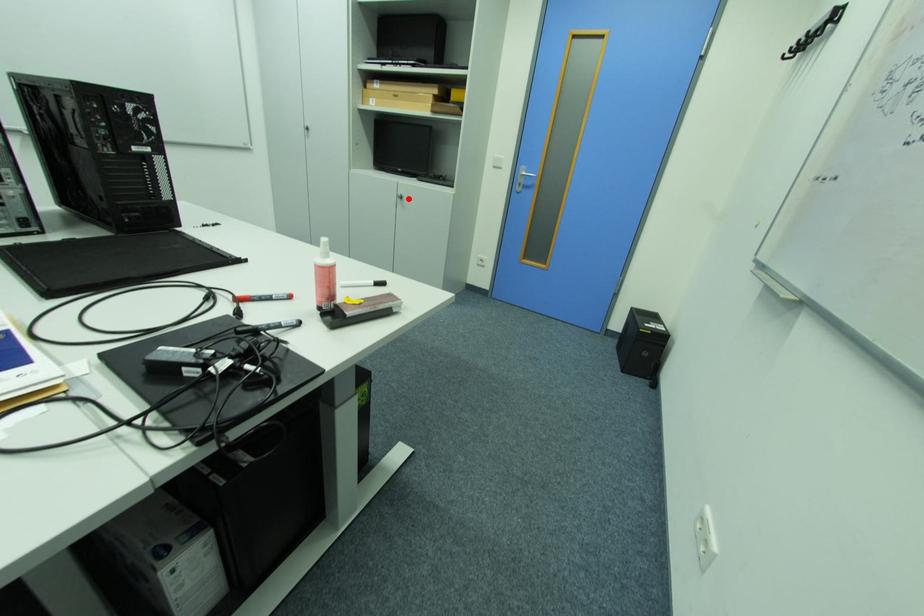
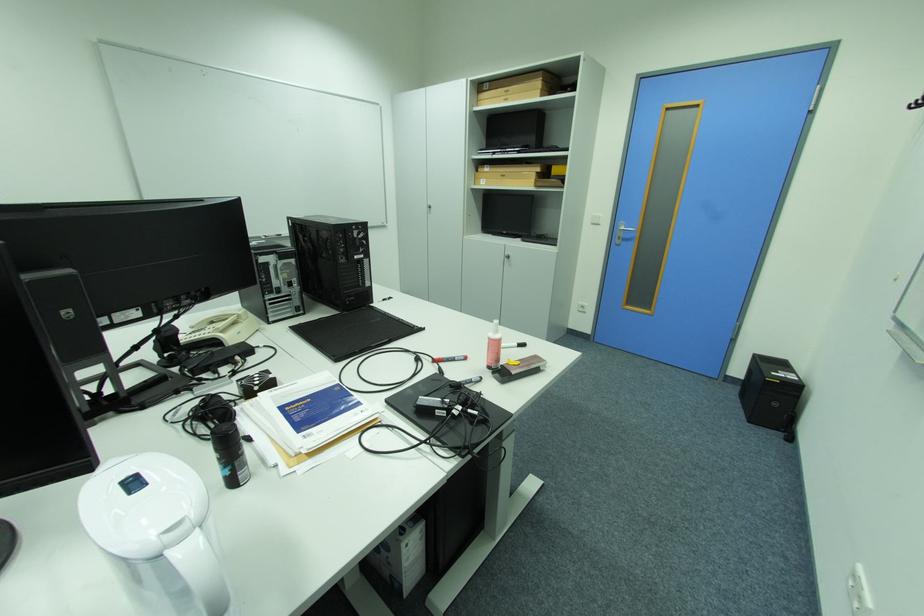
Where in the second image is the point corresponding to the highlighted location from the first image?

(516, 257)